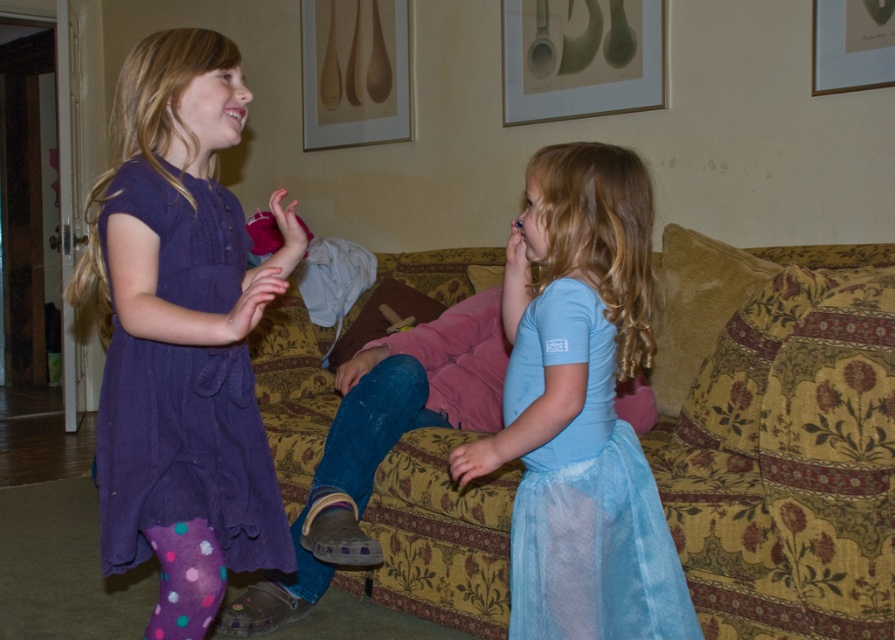
You are standing in the living room and want to reach both the point at [746,452] and the point at [553,332]. Which point is closer to you?

Point [553,332] is closer to you because it is less further away than point [746,452].